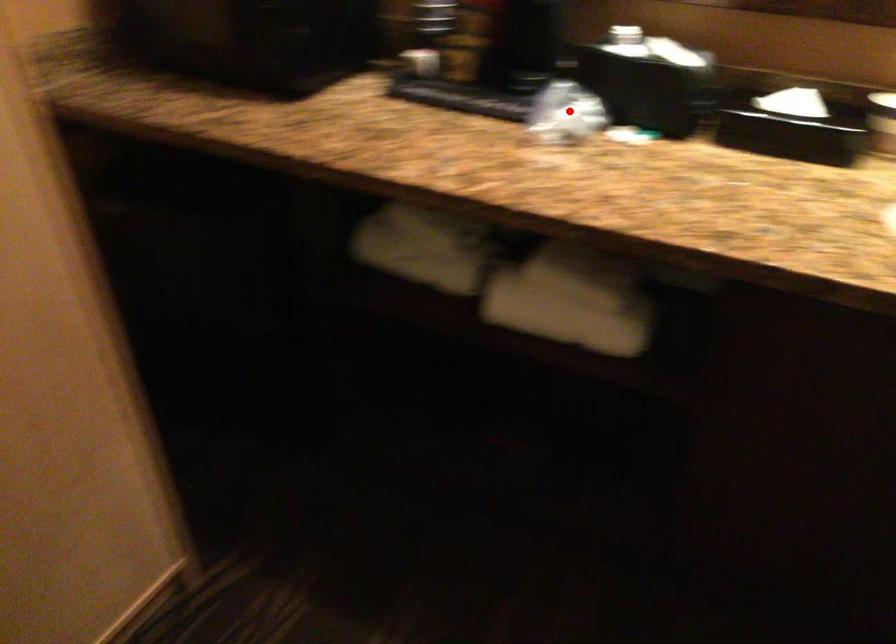
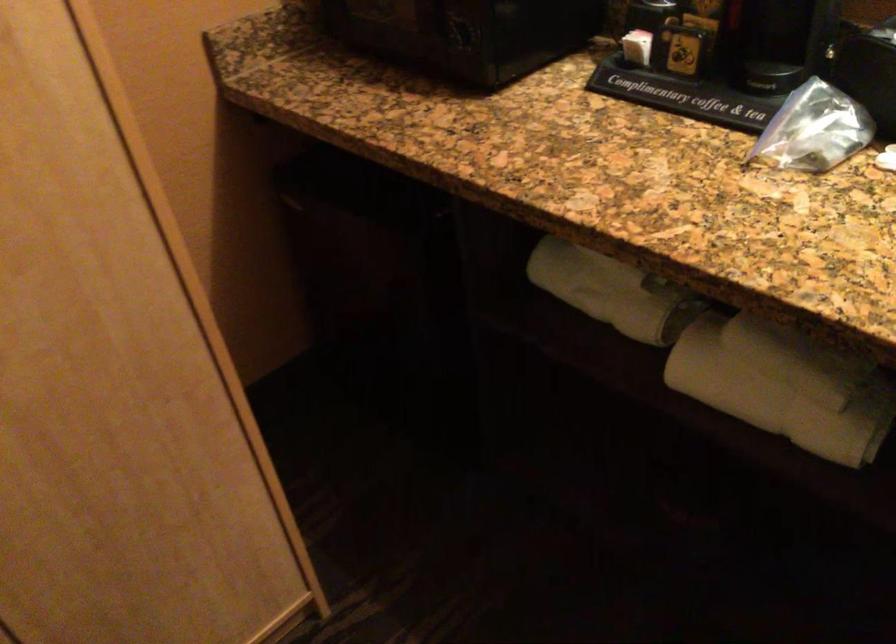
Question: I am providing you with two images of the same scene from different viewpoints. A red point is shown in image1. For the corresponding object point in image2, is it positioned nearer or farther from the camera?

Choices:
 (A) Nearer
 (B) Farther

Answer: (A)